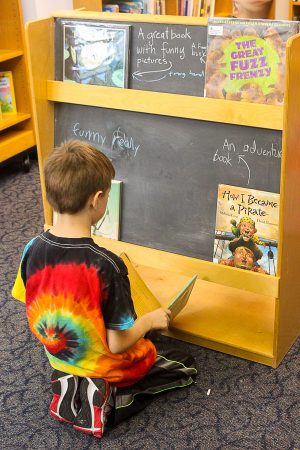
I want to click on floor, so click(x=191, y=420).